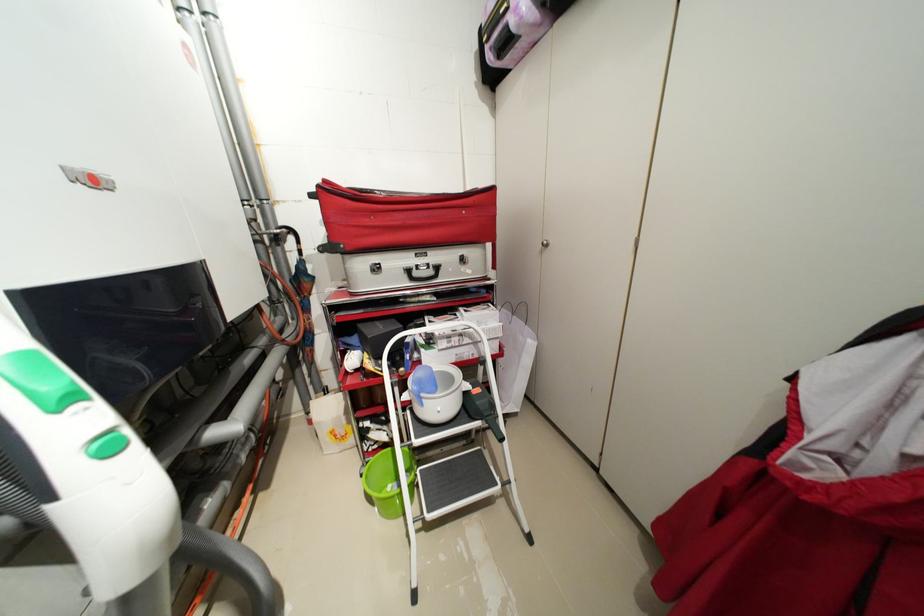
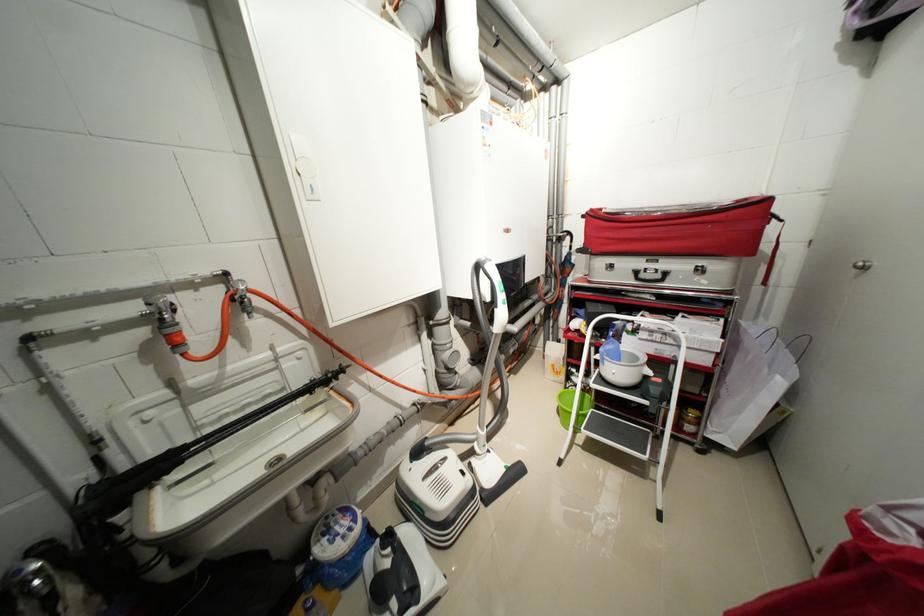
The point at (332, 182) is marked in the first image. Where is the corresponding point in the second image?

(599, 211)